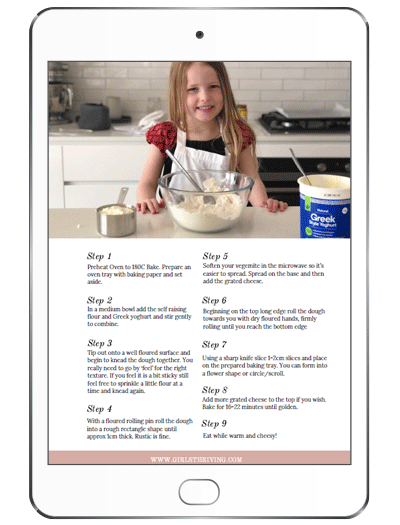
This screenshot has width=400, height=525. Identify the location of glass bowl. (241, 194).